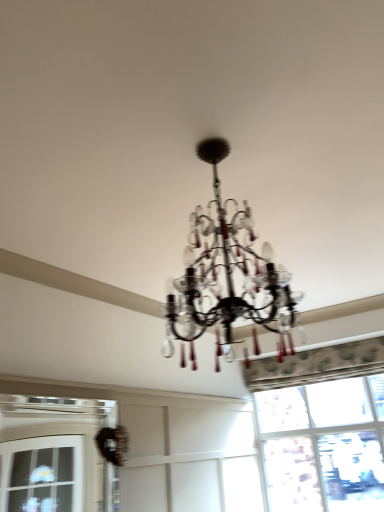
Identify the location of clear glass window at lower left, the 1th window viewed from the front. This screenshot has height=512, width=384. (55, 455).

In the scene shown: Measure the distance between point (x=45, y=429) and camera.

The distance of point (x=45, y=429) from camera is 4.05 meters.

What do you see at coordinates (55, 455) in the screenshot? I see `clear glass window at lower left, which appears as the second window when viewed from the back` at bounding box center [55, 455].

What is the approximate width of transparent glass window at lower right, arranged as the 1th window when viewed from the right?

It is 3.09 inches.

The width and height of the screenshot is (384, 512). Describe the element at coordinates (323, 446) in the screenshot. I see `transparent glass window at lower right, which is the 2th window from left to right` at that location.

What is the approximate height of transparent glass window at lower right, arranged as the 1th window when viewed from the right?

3.98 feet.

Locate an element on the screen. transparent glass window at lower right, which is the 2th window from left to right is located at coordinates (323, 446).

You are a GUI agent. You are given a task and a screenshot of the screen. Output one action in this format:
    pyautogui.click(x=<x>, y=<y>)
    Task: Click on the clear glass window at lower left, the 1th window viewed from the front
    This screenshot has width=384, height=512.
    Given the screenshot: What is the action you would take?
    pyautogui.click(x=55, y=455)

Based on their positions, is clear glass window at lower left, which appears as the second window when viewed from the back, located to the left or right of transparent glass window at lower right, which is the 2th window from left to right?

Clearly, clear glass window at lower left, which appears as the second window when viewed from the back, is on the left of transparent glass window at lower right, which is the 2th window from left to right, in the image.

Relative to transparent glass window at lower right, arranged as the 1th window when viewed from the right, is clear glass window at lower left, the 1th window viewed from the front, in front or behind?

Visually, clear glass window at lower left, the 1th window viewed from the front, is located in front of transparent glass window at lower right, arranged as the 1th window when viewed from the right.

Which is closer, (x=86, y=497) or (x=323, y=507)?

Point (x=86, y=497) appears to be farther away from the viewer than point (x=323, y=507).

From the image's perspective, is clear glass window at lower left, the 1th window viewed from the front, located beneath transparent glass window at lower right, acting as the 1th window starting from the back?

Incorrect, from the image's perspective, clear glass window at lower left, the 1th window viewed from the front, is higher than transparent glass window at lower right, acting as the 1th window starting from the back.

From a real-world perspective, who is located higher, clear glass window at lower left, which appears as the second window when viewed from the right, or transparent glass window at lower right, which is the 2th window from left to right?

From a 3D spatial view, transparent glass window at lower right, which is the 2th window from left to right, is above.

In terms of width, does clear glass window at lower left, which appears as the second window when viewed from the back, look wider or thinner when compared to transparent glass window at lower right, which is the 2th window from left to right?

Clearly, clear glass window at lower left, which appears as the second window when viewed from the back, has less width compared to transparent glass window at lower right, which is the 2th window from left to right.

Is clear glass window at lower left, the 1th window when ordered from left to right, taller than transparent glass window at lower right, arranged as the 1th window when viewed from the right?

In fact, clear glass window at lower left, the 1th window when ordered from left to right, may be shorter than transparent glass window at lower right, arranged as the 1th window when viewed from the right.

Looking at the image, does clear glass window at lower left, the 1th window when ordered from left to right, seem bigger or smaller compared to transparent glass window at lower right, acting as the 1th window starting from the back?

Clearly, clear glass window at lower left, the 1th window when ordered from left to right, is smaller in size than transparent glass window at lower right, acting as the 1th window starting from the back.

Is clear glass window at lower left, which appears as the second window when viewed from the back, surrounding transparent glass window at lower right, arranged as the 1th window when viewed from the right?

Actually, transparent glass window at lower right, arranged as the 1th window when viewed from the right, is outside clear glass window at lower left, which appears as the second window when viewed from the back.

Are clear glass window at lower left, which appears as the second window when viewed from the back, and transparent glass window at lower right, which is the 2th window from left to right, located far from each other?

That's right, there is a large distance between clear glass window at lower left, which appears as the second window when viewed from the back, and transparent glass window at lower right, which is the 2th window from left to right.

Could you tell me if clear glass window at lower left, the 1th window viewed from the front, is turned towards transparent glass window at lower right, marked as the 2th window in a front-to-back arrangement?

No, clear glass window at lower left, the 1th window viewed from the front, is not aimed at transparent glass window at lower right, marked as the 2th window in a front-to-back arrangement.

How different are the orientations of clear glass window at lower left, which appears as the second window when viewed from the back, and transparent glass window at lower right, which is the 2th window from left to right, in degrees?

The angular difference between clear glass window at lower left, which appears as the second window when viewed from the back, and transparent glass window at lower right, which is the 2th window from left to right, is 89.7 degrees.

The width and height of the screenshot is (384, 512). I want to click on window above the transparent glass window at lower right, which is the 2th window from left to right (from the image's perspective), so click(x=55, y=455).

Would you say transparent glass window at lower right, acting as the 1th window starting from the back, is to the left or to the right of clear glass window at lower left, the 1th window when ordered from left to right, in the picture?

From the image, it's evident that transparent glass window at lower right, acting as the 1th window starting from the back, is to the right of clear glass window at lower left, the 1th window when ordered from left to right.

Considering the positions of objects transparent glass window at lower right, acting as the 1th window starting from the back, and clear glass window at lower left, the 1th window when ordered from left to right, in the image provided, who is in front, transparent glass window at lower right, acting as the 1th window starting from the back, or clear glass window at lower left, the 1th window when ordered from left to right,?

clear glass window at lower left, the 1th window when ordered from left to right.

Does point (359, 503) come behind point (1, 421)?

That is False.

Based on the photo, from the image's perspective, is transparent glass window at lower right, marked as the 2th window in a front-to-back arrangement, under clear glass window at lower left, the 1th window viewed from the front?

Yes, from the image's perspective, transparent glass window at lower right, marked as the 2th window in a front-to-back arrangement, is below clear glass window at lower left, the 1th window viewed from the front.

From a real-world perspective, is transparent glass window at lower right, arranged as the 1th window when viewed from the right, physically located above or below clear glass window at lower left, which appears as the second window when viewed from the right?

Clearly, from a real-world perspective, transparent glass window at lower right, arranged as the 1th window when viewed from the right, is above clear glass window at lower left, which appears as the second window when viewed from the right.

Which object is wider, transparent glass window at lower right, arranged as the 1th window when viewed from the right, or clear glass window at lower left, which appears as the second window when viewed from the back?

transparent glass window at lower right, arranged as the 1th window when viewed from the right, is wider.

Looking at this image, considering the relative sizes of transparent glass window at lower right, which is the 2th window from left to right, and clear glass window at lower left, which appears as the second window when viewed from the back, in the image provided, is transparent glass window at lower right, which is the 2th window from left to right, shorter than clear glass window at lower left, which appears as the second window when viewed from the back,?

No, transparent glass window at lower right, which is the 2th window from left to right, is not shorter than clear glass window at lower left, which appears as the second window when viewed from the back.

Can you confirm if transparent glass window at lower right, arranged as the 1th window when viewed from the right, is bigger than clear glass window at lower left, which appears as the second window when viewed from the back?

Correct, transparent glass window at lower right, arranged as the 1th window when viewed from the right, is larger in size than clear glass window at lower left, which appears as the second window when viewed from the back.

Would you say transparent glass window at lower right, arranged as the 1th window when viewed from the right, contains clear glass window at lower left, which appears as the second window when viewed from the back?

Definitely not — clear glass window at lower left, which appears as the second window when viewed from the back, is not inside transparent glass window at lower right, arranged as the 1th window when viewed from the right.

Is the surface of transparent glass window at lower right, which is the 2th window from left to right, in direct contact with clear glass window at lower left, the 1th window when ordered from left to right?

transparent glass window at lower right, which is the 2th window from left to right, and clear glass window at lower left, the 1th window when ordered from left to right, are not in contact.

Is clear glass window at lower left, which appears as the second window when viewed from the right, at the back of transparent glass window at lower right, which is the 2th window from left to right?

No.

What's the angular difference between transparent glass window at lower right, marked as the 2th window in a front-to-back arrangement, and clear glass window at lower left, the 1th window viewed from the front,'s facing directions?

The angular difference between transparent glass window at lower right, marked as the 2th window in a front-to-back arrangement, and clear glass window at lower left, the 1th window viewed from the front, is 89.7 degrees.

Find the location of a particular element. Image resolution: width=384 pixels, height=512 pixels. window on the left of transparent glass window at lower right, arranged as the 1th window when viewed from the right is located at coordinates (55, 455).

In the image, there is a clear glass window at lower left, which appears as the second window when viewed from the back. Find the location of `window below it (from the image's perspective)`. window below it (from the image's perspective) is located at coordinates (323, 446).

Identify the location of window in front of the transparent glass window at lower right, arranged as the 1th window when viewed from the right. (55, 455).